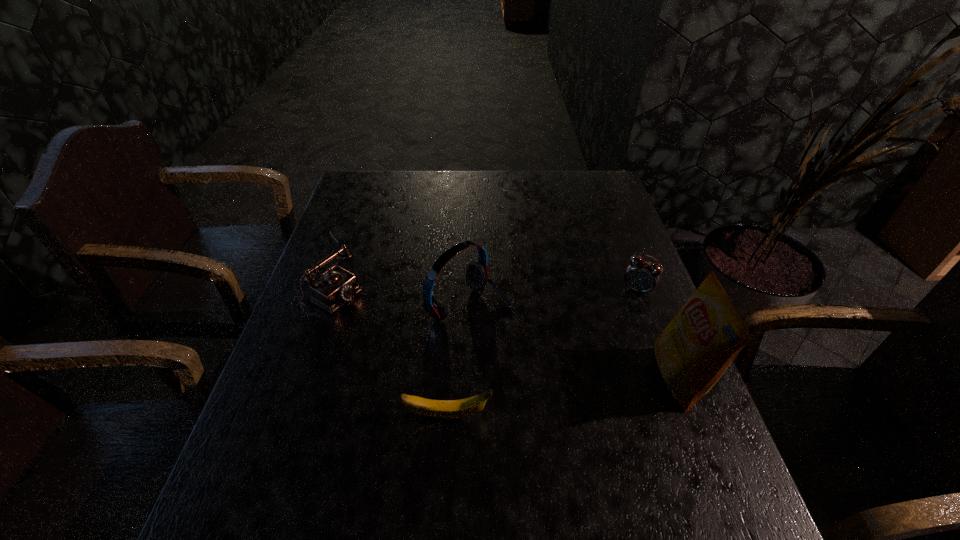
The image size is (960, 540). I want to click on unoccupied position between the headset and the tallest object, so click(574, 340).

Where is `vacant area that lies between the telephone and the headset`? This screenshot has width=960, height=540. vacant area that lies between the telephone and the headset is located at coordinates (404, 288).

Where is `free space that is in between the headset and the tallest object`? Image resolution: width=960 pixels, height=540 pixels. free space that is in between the headset and the tallest object is located at coordinates point(574,340).

Locate an element on the screen. The height and width of the screenshot is (540, 960). vacant area between the second tallest object and the alarm clock is located at coordinates (553, 296).

Identify which object is the nearest to the headset. Please provide its 2D coordinates. Your answer should be formatted as a tuple, i.e. [(x, y)], where the tuple contains the x and y coordinates of a point satisfying the conditions above.

[(338, 286)]

Select which object is the third closest to the leftmost object. Please provide its 2D coordinates. Your answer should be formatted as a tuple, i.e. [(x, y)], where the tuple contains the x and y coordinates of a point satisfying the conditions above.

[(642, 276)]

Identify the location of vacant area that satisfies the following two spatial constraints: 1. on the back side of the alarm clock; 2. on the right side of the fourth shortest object. (468, 289).

This screenshot has width=960, height=540. What are the coordinates of `free location that satisfies the following two spatial constraints: 1. on the front side of the leftmost object; 2. at the stem of the banana` in the screenshot? It's located at (291, 416).

Where is `blank area in the image that satisfies the following two spatial constraints: 1. on the front side of the tallest object; 2. on the front-facing side of the fourth shortest object`? Image resolution: width=960 pixels, height=540 pixels. blank area in the image that satisfies the following two spatial constraints: 1. on the front side of the tallest object; 2. on the front-facing side of the fourth shortest object is located at coordinates (467, 377).